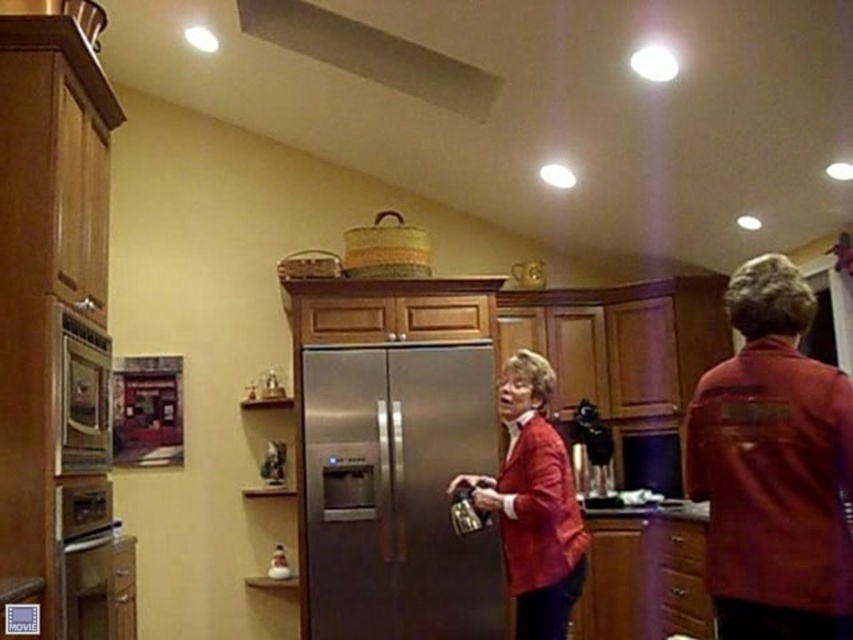
You are standing in the kitchen and see two points marked in the image. Which point is closer to you, point (547,365) or point (93,376)?

Point (547,365) is further to the viewer than point (93,376), so point (93,376) is closer to you.

You are standing in the kitchen and see the matte red jacket at center and the stainless steel oven at left. Which object is nearer to you?

The matte red jacket at center is closer to the viewer than the stainless steel oven at left.